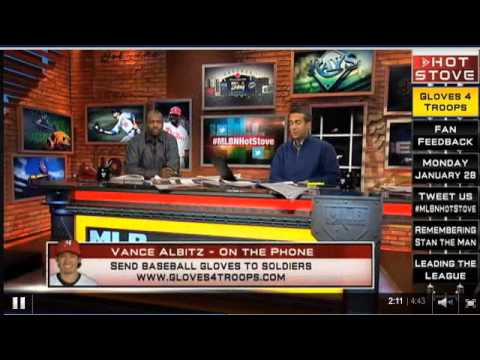
Identify the location of flooring. (394, 256), (26, 255).